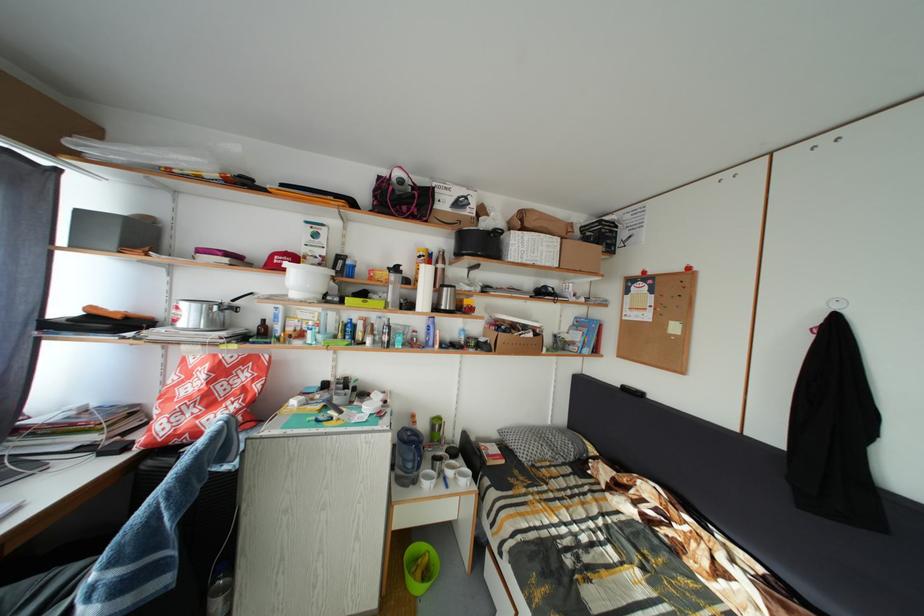
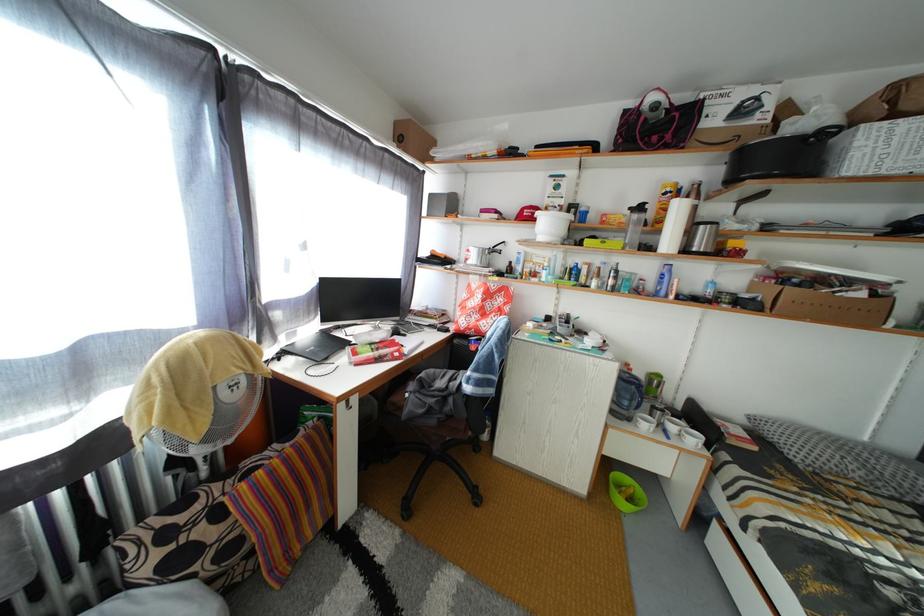
Question: The camera is either moving clockwise (left) or counter-clockwise (right) around the object. The first image is from the beginning of the video and the second image is from the end. Is the camera moving left or right when shooting the video?

Choices:
 (A) Left
 (B) Right

Answer: (B)